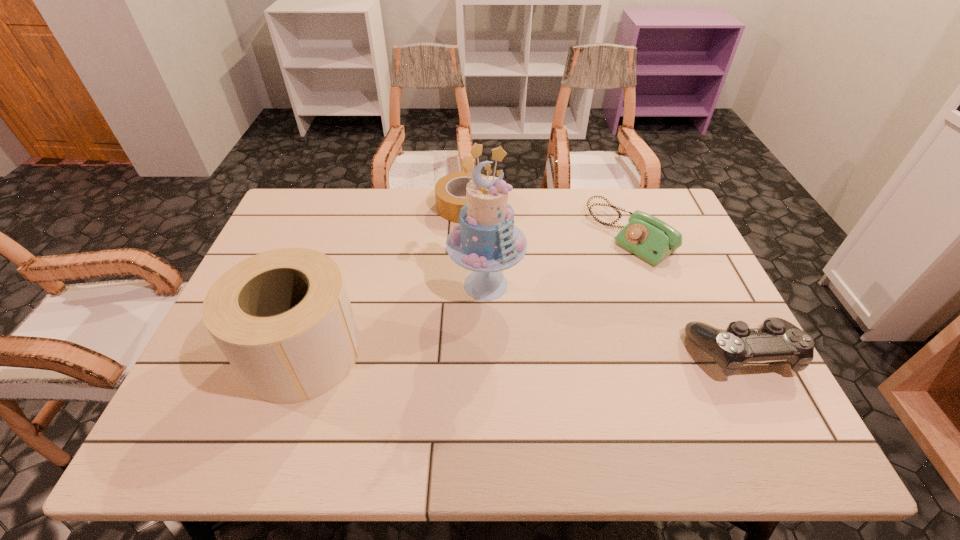
Locate an element on the screen. The image size is (960, 540). vacant spot on the desktop that is between the toilet tissue and the control and is positioned with a ladder on the side of the cake is located at coordinates (498, 352).

You are a GUI agent. You are given a task and a screenshot of the screen. Output one action in this format:
    pyautogui.click(x=<x>, y=<y>)
    Task: Click on the vacant space on the desktop that is between the fourth shortest object and the control and is positioned on the dial of the telephone
    Image resolution: width=960 pixels, height=540 pixels.
    Given the screenshot: What is the action you would take?
    pyautogui.click(x=459, y=352)

Locate an element on the screen. Image resolution: width=960 pixels, height=540 pixels. free space on the desktop that is between the leftmost object and the control and is positioned at the edge of the shortest object is located at coordinates (x=479, y=352).